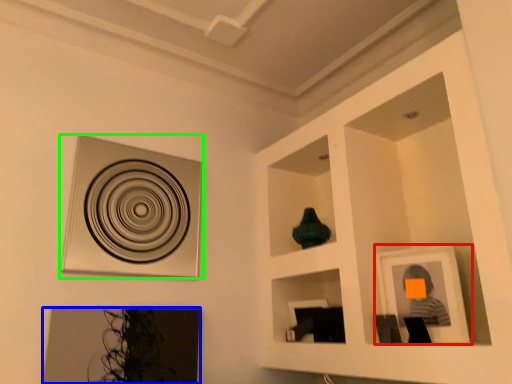
Question: Based on their relative distances, which object is farther from picture frame (highlighted by a red box)? Choose from picture frame (highlighted by a blue box) and picture frame (highlighted by a green box).

Choices:
 (A) picture frame
 (B) picture frame

Answer: (B)